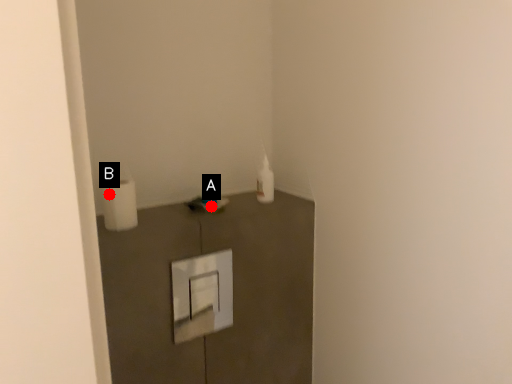
Question: Two points are circled on the image, labeled by A and B beside each circle. Which point appears farthest from the camera in this image?

Choices:
 (A) A is further
 (B) B is further

Answer: (A)